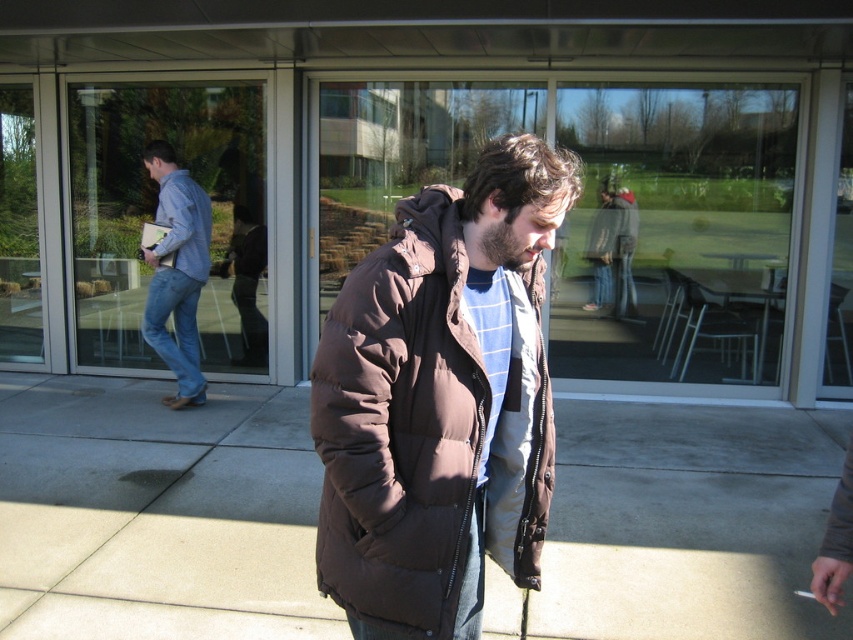
Question: Does brown fabric pavement at center lie in front of brown puffy jacket at center?

Choices:
 (A) yes
 (B) no

Answer: (B)

Question: Which object is positioned farthest from the transparent glass door at center?

Choices:
 (A) denim jeans at left
 (B) brown puffy jacket at center

Answer: (B)

Question: Estimate the real-world distances between objects in this image. Which object is farther from the brown fabric pavement at center?

Choices:
 (A) brown puffy jacket at center
 (B) denim jeans at left

Answer: (A)

Question: Which object is closer to the camera taking this photo?

Choices:
 (A) brown fabric pavement at center
 (B) denim jeans at left

Answer: (A)

Question: Is brown fabric pavement at center positioned before brown puffy jacket at center?

Choices:
 (A) yes
 (B) no

Answer: (B)

Question: Is brown fabric pavement at center in front of brown puffy jacket at center?

Choices:
 (A) no
 (B) yes

Answer: (A)